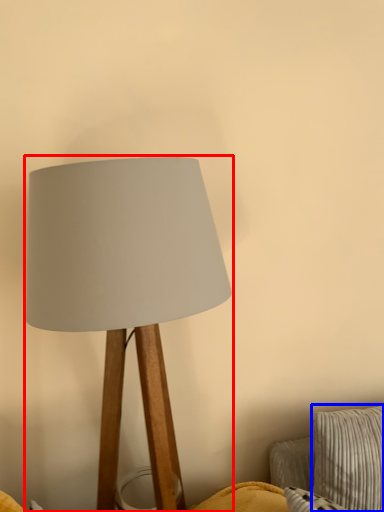
Question: Which of the following is the closest to the observer, lamp (highlighted by a red box) or pillow (highlighted by a blue box)?

Choices:
 (A) lamp
 (B) pillow

Answer: (A)